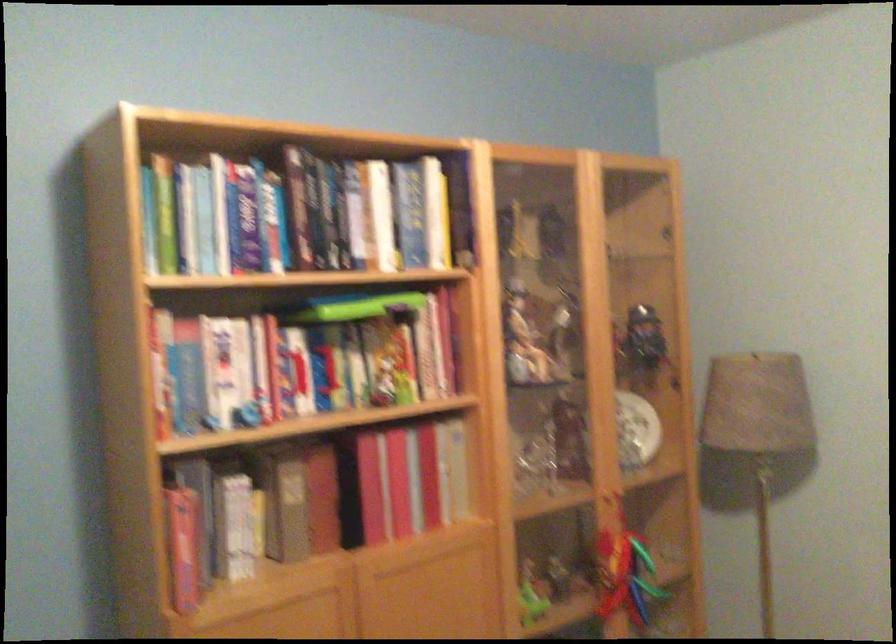
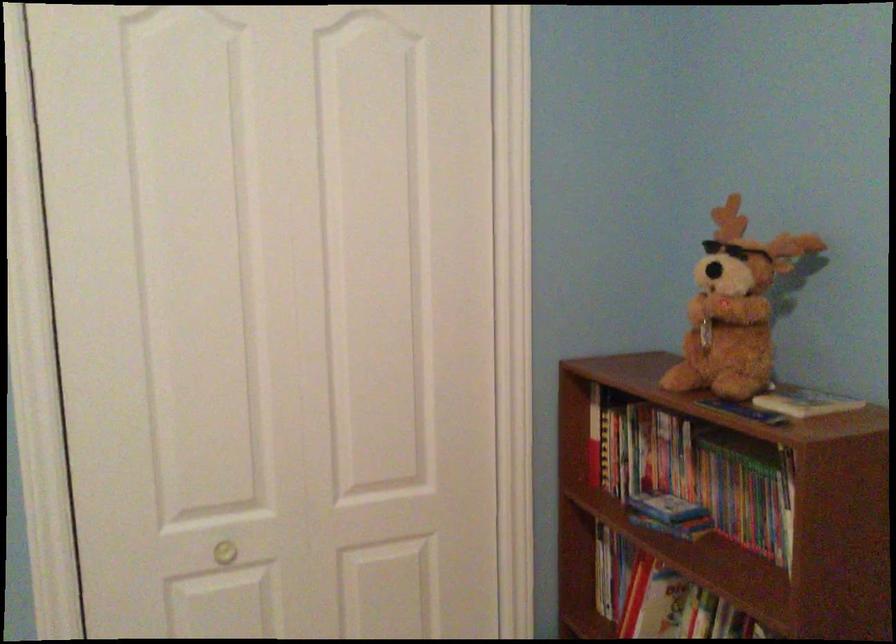
Question: The images are taken continuously from a first-person perspective. In which direction is your viewpoint rotating?

Choices:
 (A) Left
 (B) Right
 (C) Up
 (D) Down

Answer: (A)